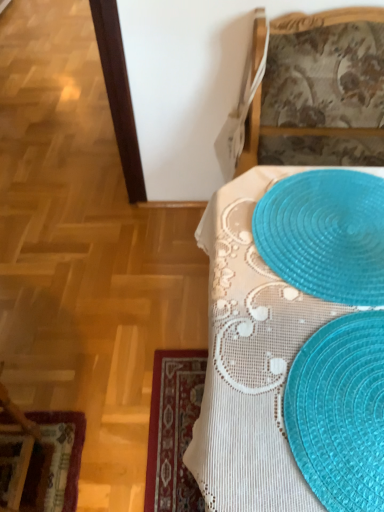
Locate an element on the screen. empty space that is ontop of velvet burgundy placemat at lower left is located at coordinates (53, 457).